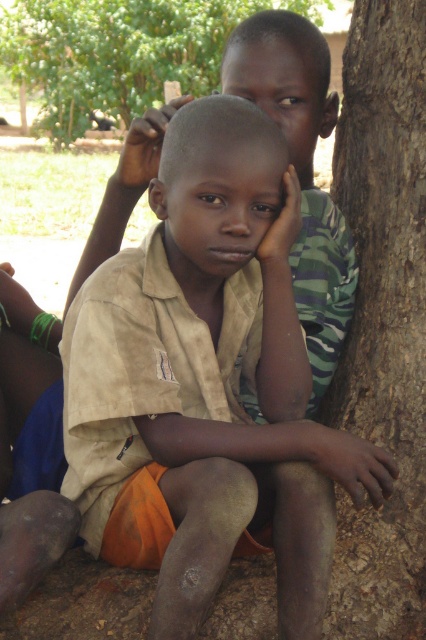
You are standing at the origin point in the image. The brown rough tree trunk at right is located at coordinates 0.497, 0.899. If you want to walk directly towards it, which direction should you move?

The brown rough tree trunk at right is located at coordinates (382,317), so you should move towards the right and slightly downward to reach it.